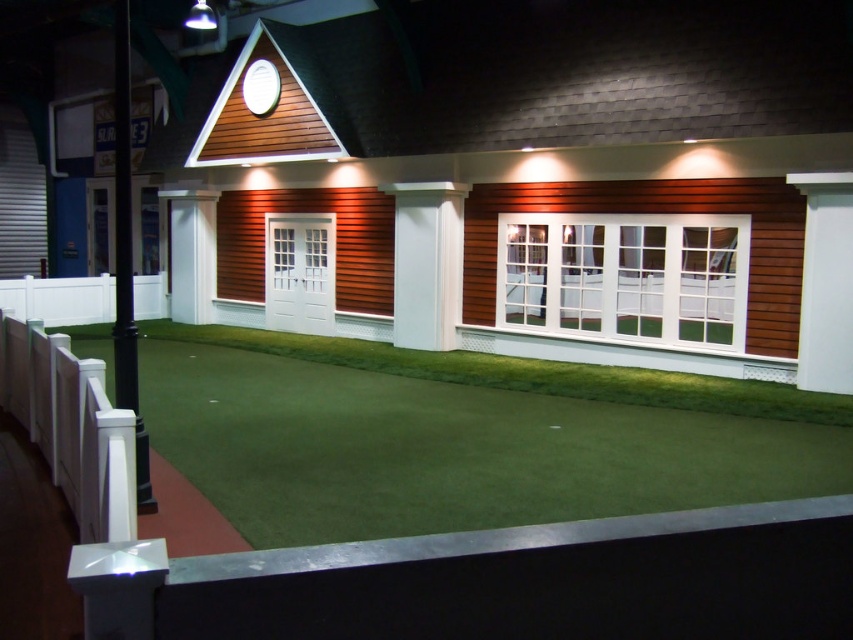
Image resolution: width=853 pixels, height=640 pixels. What do you see at coordinates (463, 435) in the screenshot?
I see `green artificial turf at center` at bounding box center [463, 435].

Is the position of green artificial turf at center less distant than that of white smooth column at center?

Yes.

The height and width of the screenshot is (640, 853). Describe the element at coordinates (463, 435) in the screenshot. I see `green artificial turf at center` at that location.

Image resolution: width=853 pixels, height=640 pixels. I want to click on green artificial turf at center, so click(x=463, y=435).